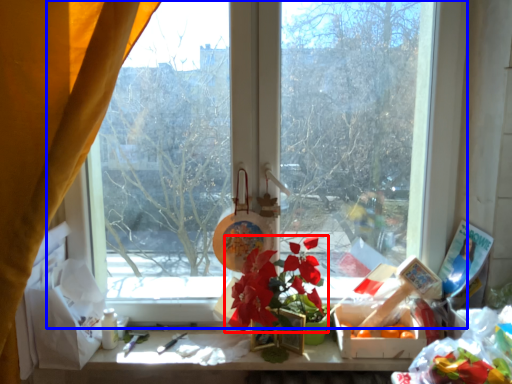
Question: Among these objects, which one is farthest to the camera, flower (highlighted by a red box) or window (highlighted by a blue box)?

Choices:
 (A) flower
 (B) window

Answer: (B)